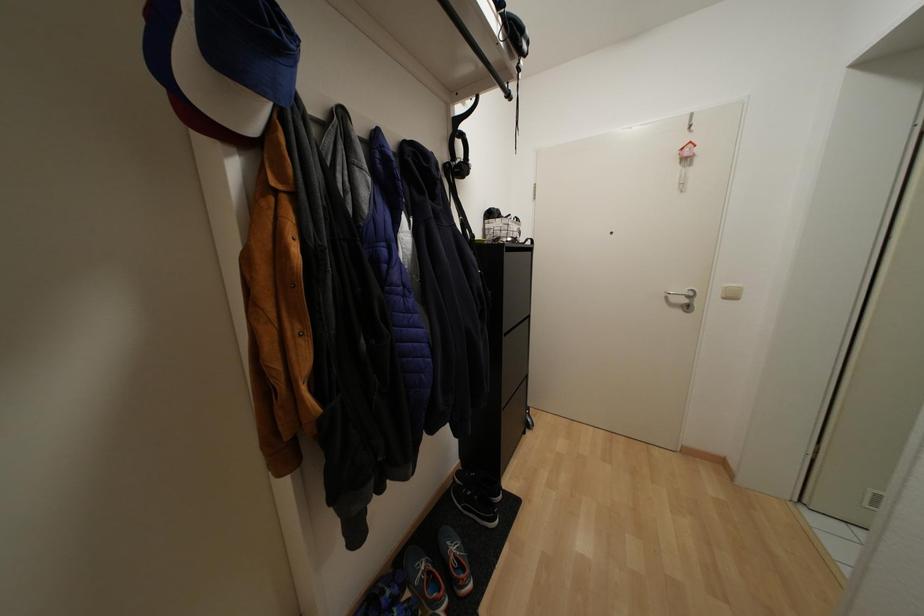
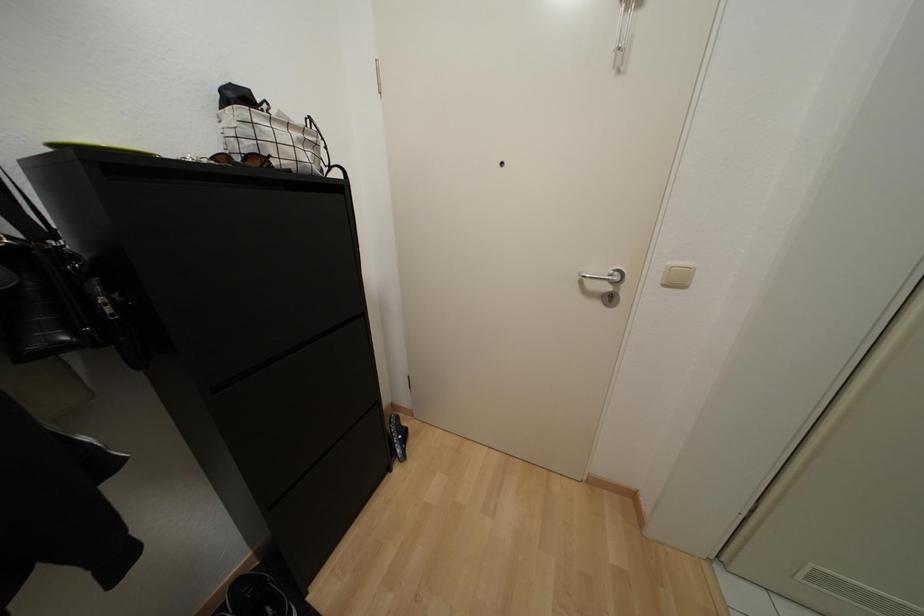
In a continuous first-person perspective shot, in which direction is the camera moving?

The cameraman moved toward right, forward.